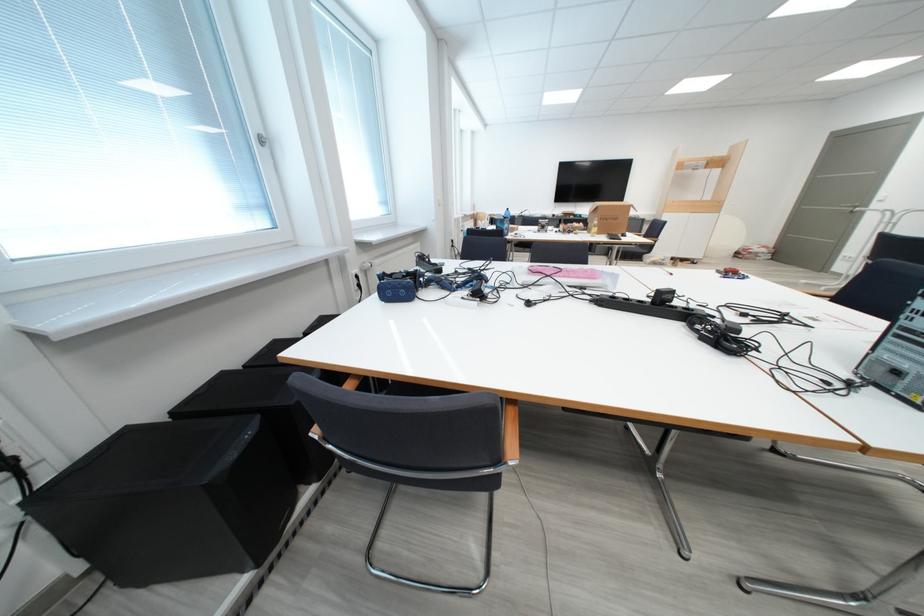
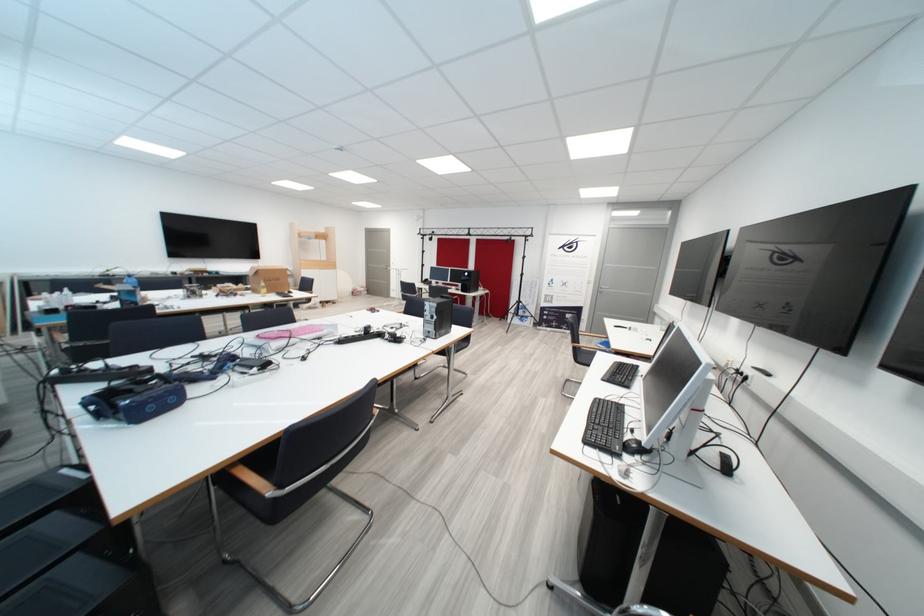
Question: I am providing you with two images of the same scene from different viewpoints. Please identify which objects are invisible in image2.

Choices:
 (A) black computer mouse
 (B) blue VR headset
 (C) plastic water bottle
 (D) none of these

Answer: (D)